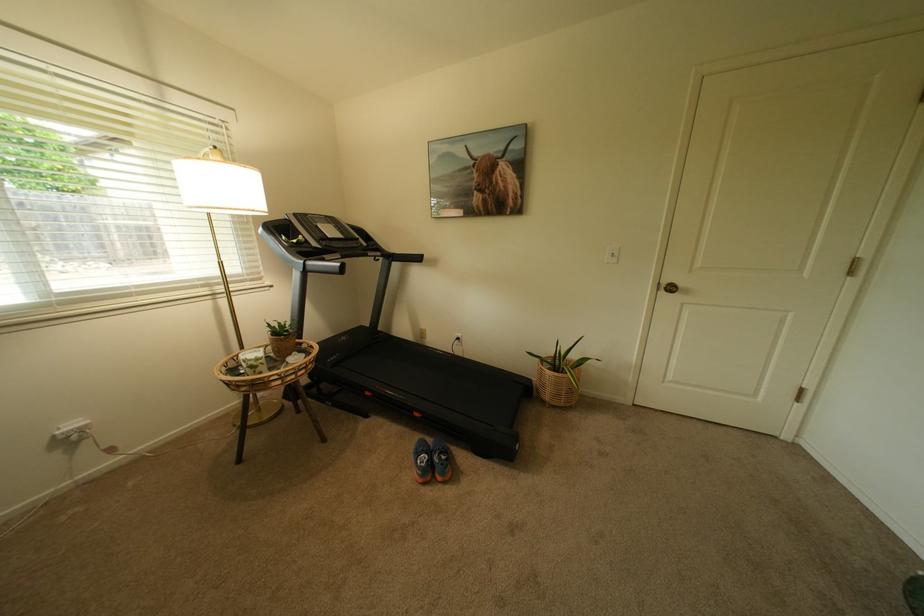
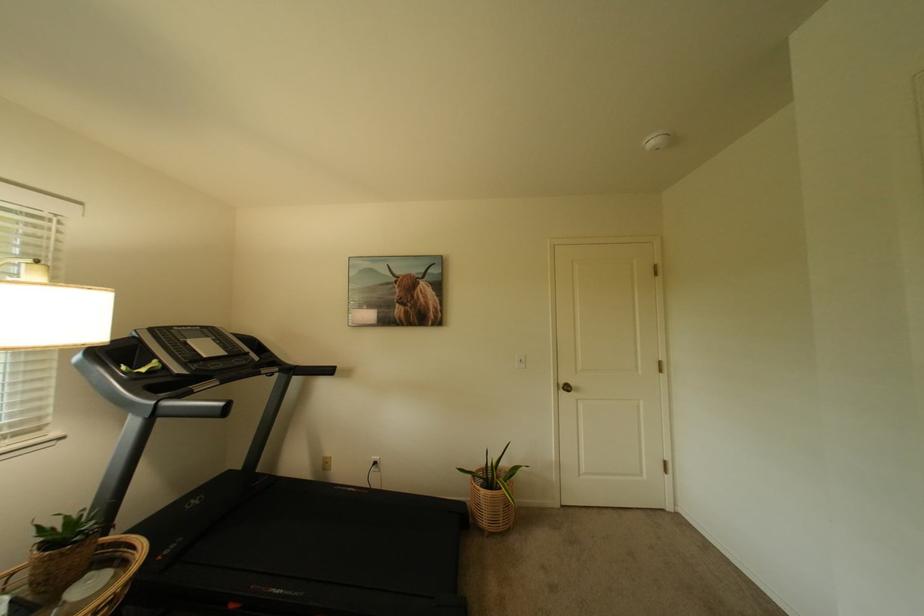
Where in the second image is the point corresponding to (x=557, y=391) from the first image?

(495, 515)